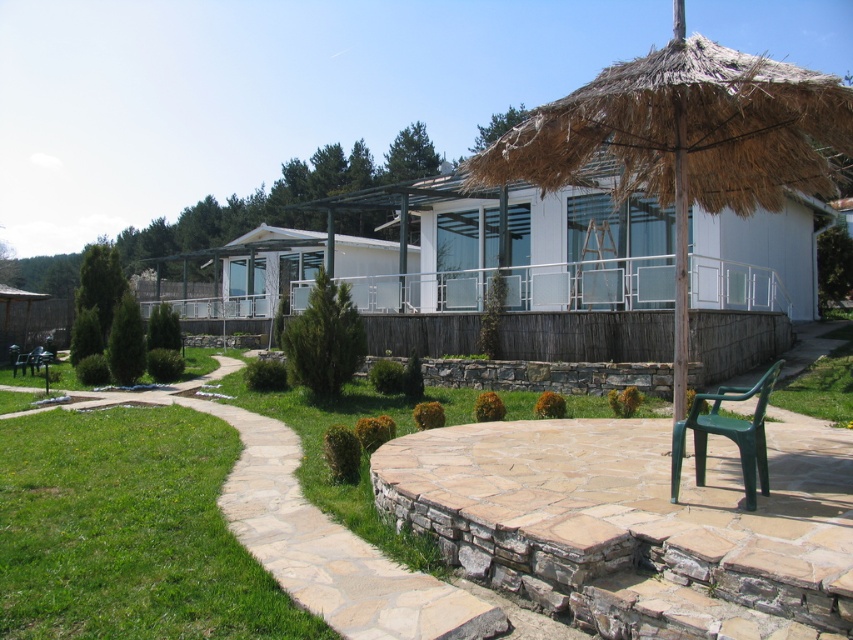
In the scene shown: You are standing on the wooden deck and want to see the green plastic chair at center. Is the white glass hut at center blocking your view of it?

The white glass hut at center is above the green plastic chair at center, so it might block your view depending on the angle, but since the hut is glass, you can still see the chair through it.

You are standing at the entrance of the house and want to place a new potted plant exactly at the center of the patio. The coordinates of the patio are from point A at the bottom left corner to point B at the top right corner. Given that the thatched straw umbrella at center is located at coordinates 0.220, 0.803, can you determine if the umbrella is closer to point A or point B?

The thatched straw umbrella at center is located at coordinates (683, 140). Since point A is at the bottom left corner and point B is at the top right corner, the umbrella is closer to point A because its x and y coordinates are closer to the lower left values compared to the upper right values.